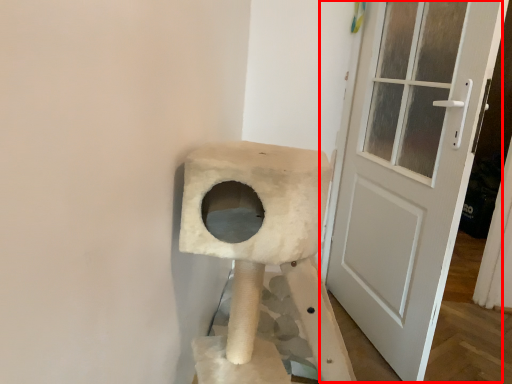
Question: From the image's perspective, what is the correct spatial positioning of door (annotated by the red box) in reference to cat furniture?

Choices:
 (A) above
 (B) below

Answer: (A)